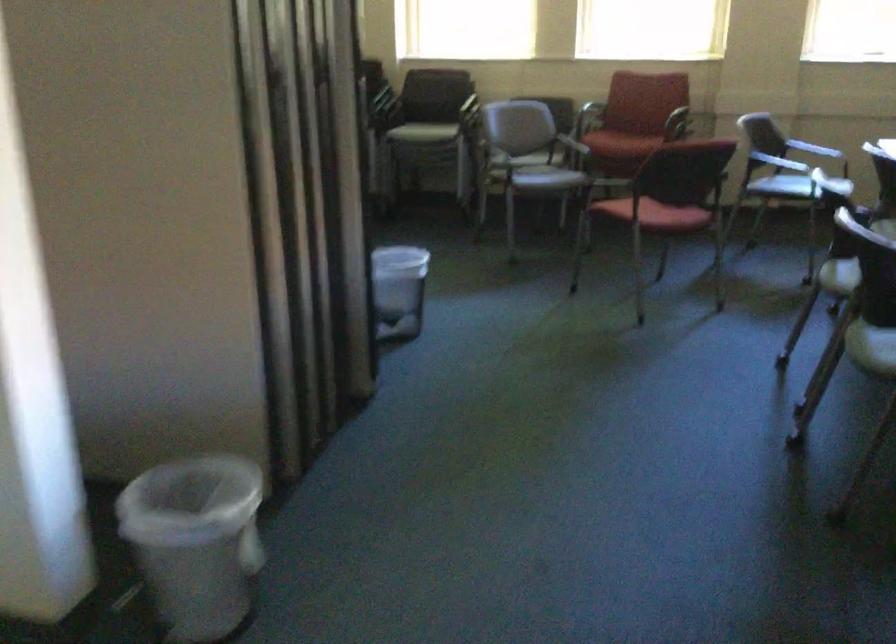
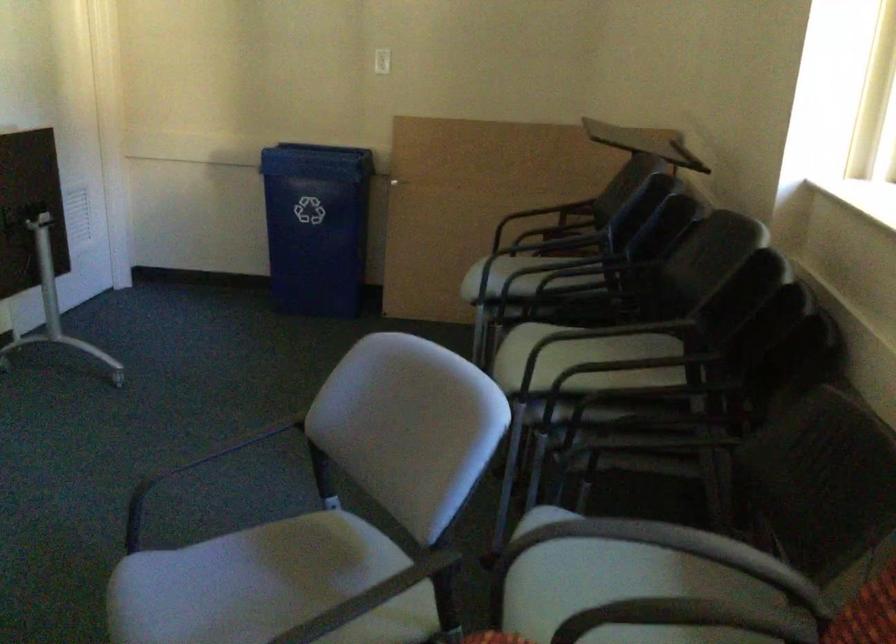
The point at (536, 166) is marked in the first image. Where is the corresponding point in the second image?

(271, 565)